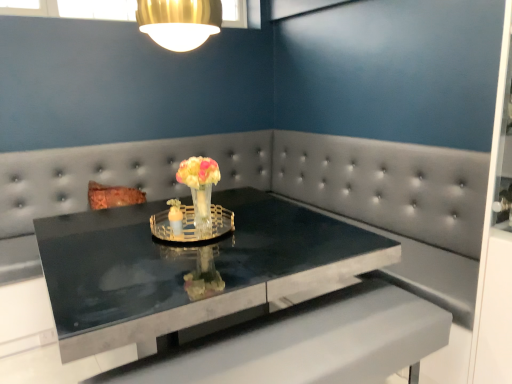
Question: From the image's perspective, is black marble table at center positioned above or below clear glass candle holder at center, placed as the 1th candle holder when sorted from right to left?

Choices:
 (A) above
 (B) below

Answer: (B)

Question: Is black marble table at center in front of or behind clear glass candle holder at center, acting as the second candle holder starting from the left, in the image?

Choices:
 (A) front
 (B) behind

Answer: (A)

Question: Which object is the closest to the translucent glass candle holder at center, which is the 1th candle holder from left to right?

Choices:
 (A) black marble table at center
 (B) translucent glass vase at center
 (C) clear glass candle holder at center, acting as the second candle holder starting from the left

Answer: (C)

Question: Which object is the farthest from the clear glass candle holder at center, placed as the 1th candle holder when sorted from right to left?

Choices:
 (A) translucent glass vase at center
 (B) black marble table at center
 (C) translucent glass candle holder at center, which is the 1th candle holder from left to right

Answer: (B)